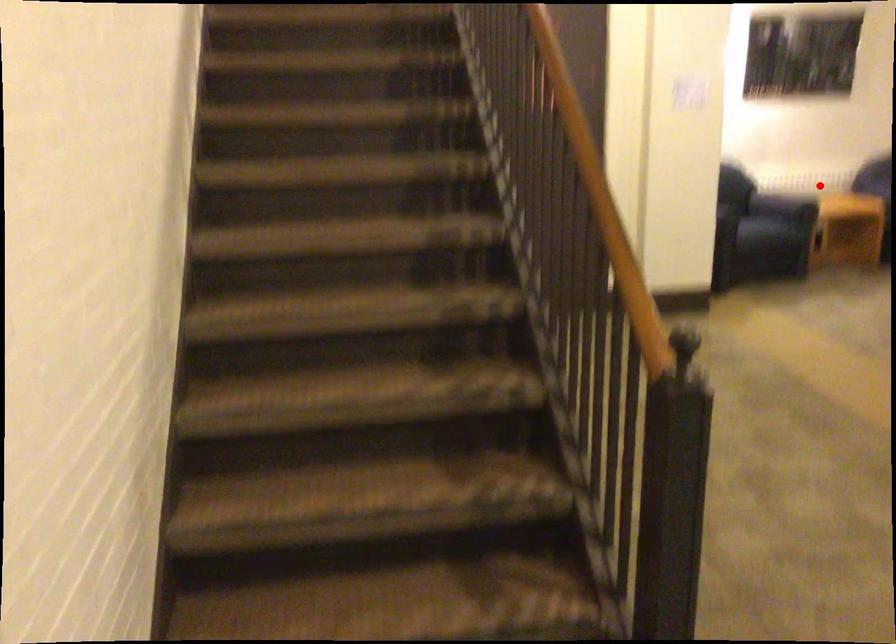
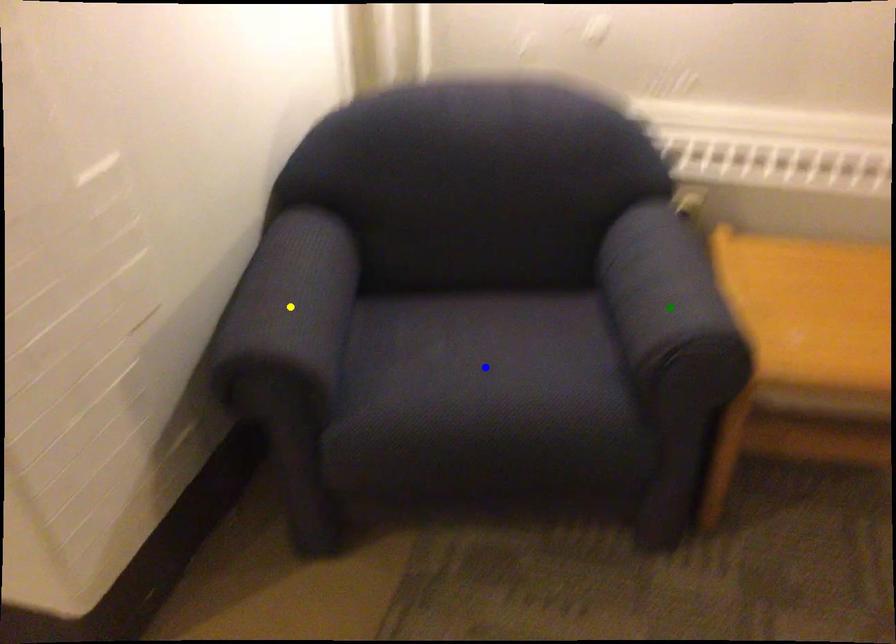
Question: I am providing you with two images of the same scene from different viewpoints. A red point is marked on the first image. You are given multiple points on the second image. Which point in image 2 represents the same 3d spot as the red point in image 1?

Choices:
 (A) yellow point
 (B) green point
 (C) blue point

Answer: (B)